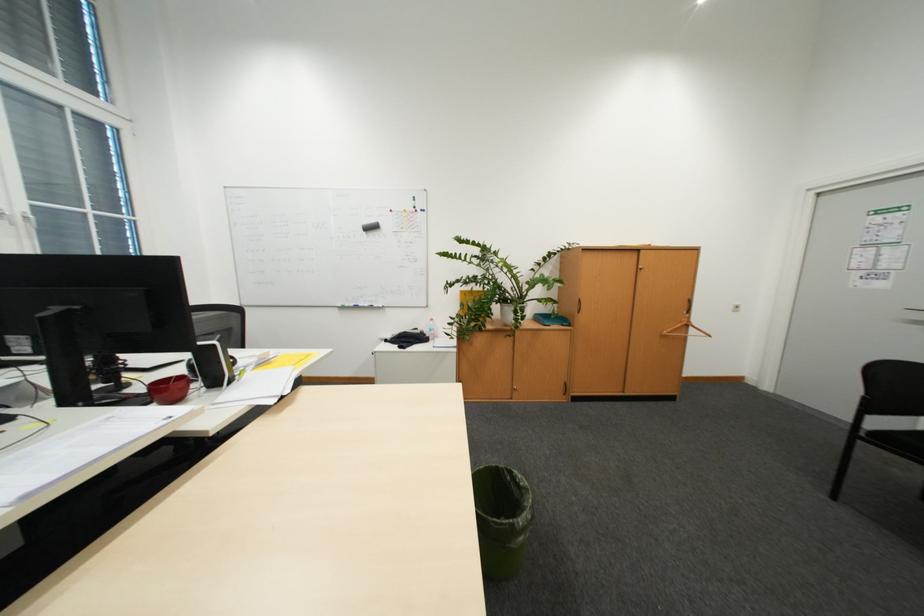
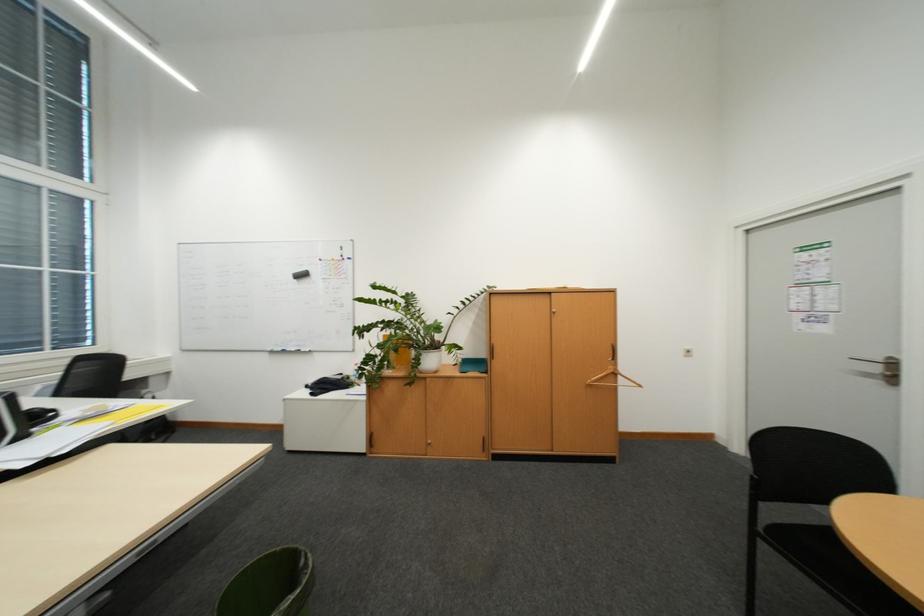
Question: The images are taken continuously from a first-person perspective. In which direction is your viewpoint rotating?

Choices:
 (A) Left
 (B) Right
 (C) Up
 (D) Down

Answer: (C)